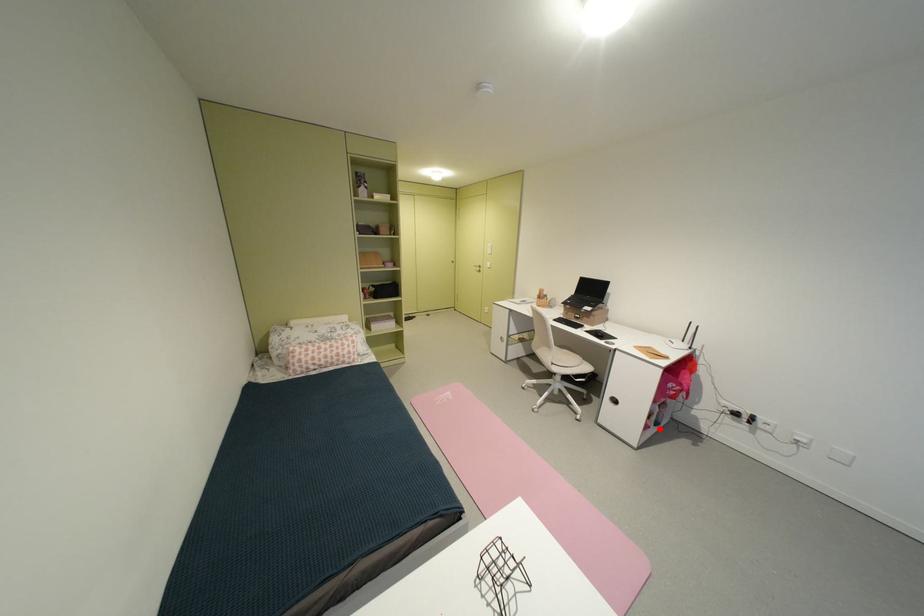
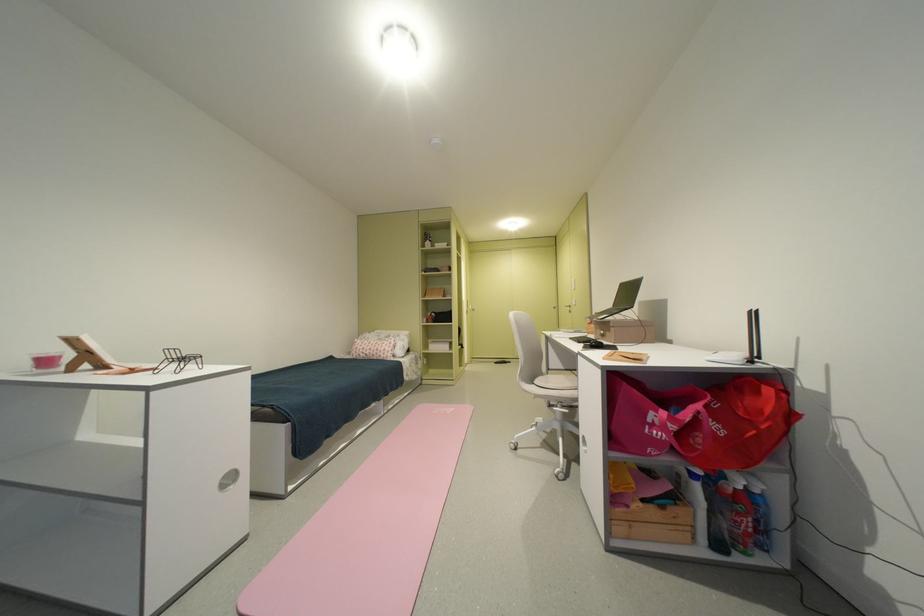
Where in the second image is the point corresponding to the highlighted location from the first image?

(638, 508)